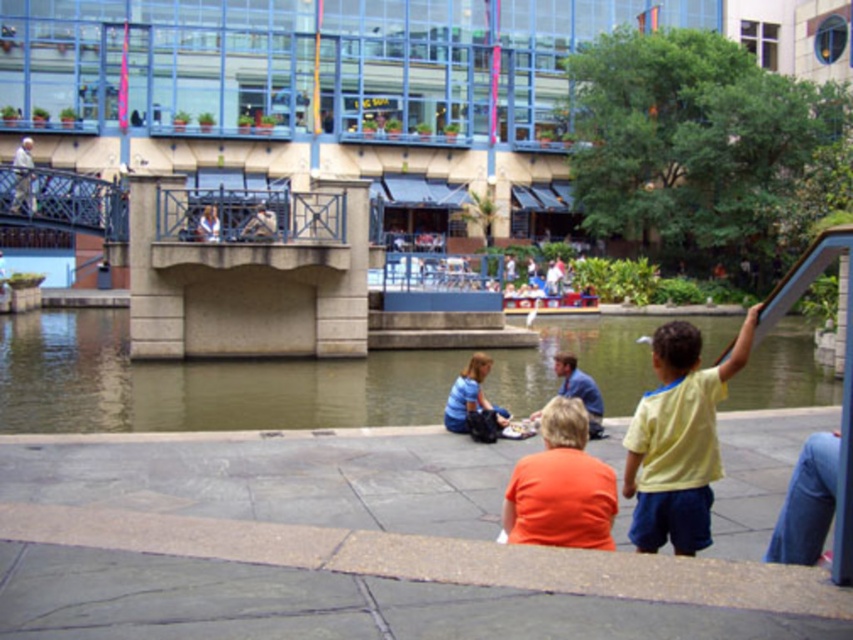
You are a photographer standing at the riverside. You want to capture a photo that includes both the greenish water at center and the light blue shirt at upper center. Given their relative sizes in the image, which object will appear wider in the photo?

The greenish water at center will appear wider in the photo because its width is larger than the light blue shirt at upper center.

In the scene shown: You are standing at the origin point in the image. There is a blue denim shirt at center represented by point (579, 390). What is the coordinate of the blue denim shirt at center?

The coordinate of the blue denim shirt at center is point (579, 390).

You are a photographer planning to take a photo of the greenish water at center and the light blue shirt at upper center. Based on their positions, which one will appear larger in the photo?

The greenish water at center appears larger in the photo because it is much taller than the light blue shirt at upper center.